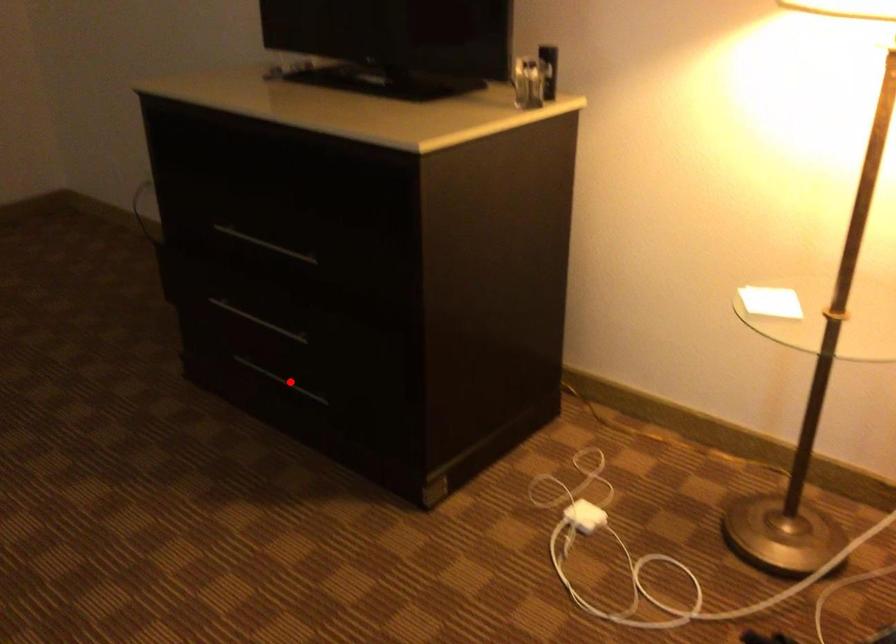
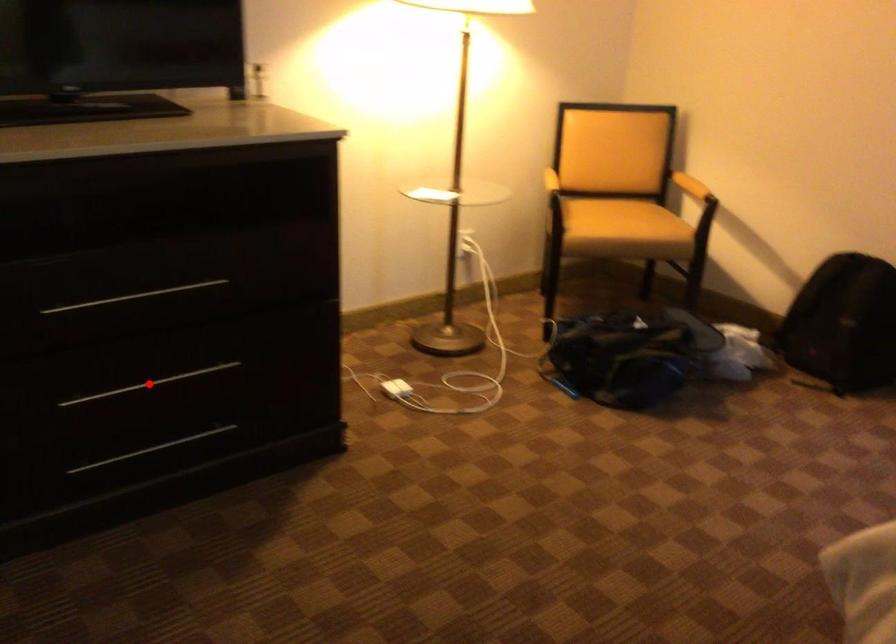
I am providing you with two images of the same scene from different viewpoints. A red point is marked on the first image and another point is marked on the second image. Is the red point in image1 aligned with the point shown in image2?

No